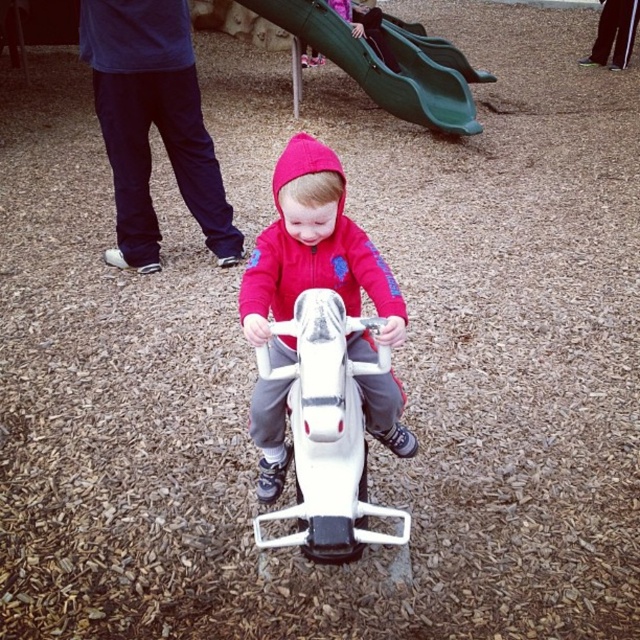
You are a parent trying to decide whether your child can easily see over the white plastic toy car at center while standing next to the green plastic slide at upper center. Based on their heights, can your child see over the car?

The white plastic toy car at center is shorter than the green plastic slide at upper center. Since the car is shorter, your child should be able to see over it when standing next to the slide.

You are a parent at the playground and see your child wearing a matte pink hoodie at center and sitting on a white plastic toy car at center. Which item is positioned more to the right from your viewpoint?

The matte pink hoodie at center is positioned to the right of the white plastic toy car at center, so the matte pink hoodie at center is more to the right.

You are a parent trying to decide whether to place a small sticker on the matte pink hoodie at center or the white plastic toy car at center. Since the sticker is 10 cm wide, which object would you choose to place it on?

The matte pink hoodie at center is wider than the white plastic toy car at center, so the sticker can fit on the matte pink hoodie at center.